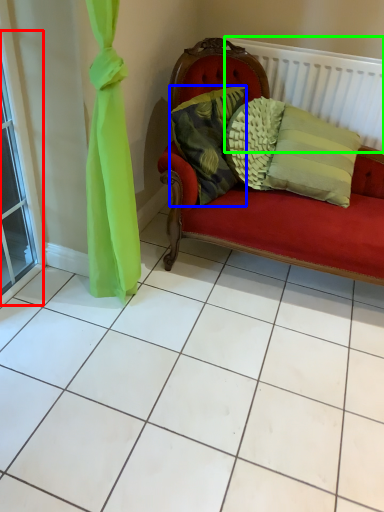
Question: Based on their relative distances, which object is farther from window (highlighted by a red box)? Choose from pillow (highlighted by a blue box) and balustrade (highlighted by a green box).

Choices:
 (A) pillow
 (B) balustrade

Answer: (B)